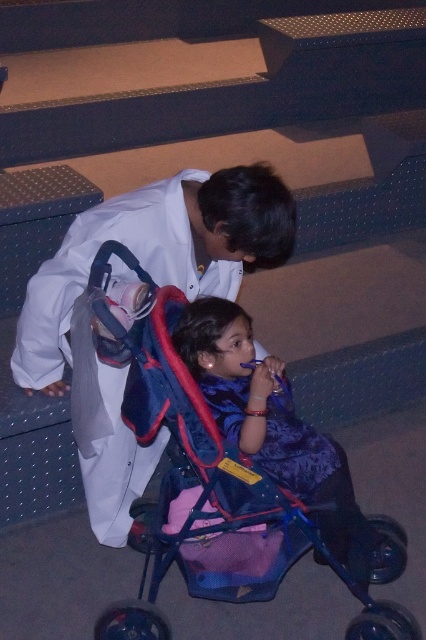
You are an event planner setting up a stage for a presentation. The stage has a coordinate system where the bottom left corner is the origin point. You need to place a microphone stand at the point exactly halfway between the white matte coat at upper left and the edge of the stage. What is the coordinate of the point where you should place the microphone stand?

The white matte coat at upper left is located at coordinate point (157, 284). To find the halfway point between this object and the edge of the stage, we first need to determine the coordinate of the edge. Since the stage coordinate system starts at the bottom left corner, the edge would be at the maximum x or y value depending on which edge we are considering. However, without knowing the exact dimensions of the stage or which edge the question refers to, it is impossible to calculate the exact halfway.

You are a parent trying to navigate through the theater seats. You see the blue plastic baby carriage at center and the blue fabric stroller at lower center. Which one is positioned lower in the image?

The blue plastic baby carriage at center is located below the blue fabric stroller at lower center, so it is positioned lower in the image.